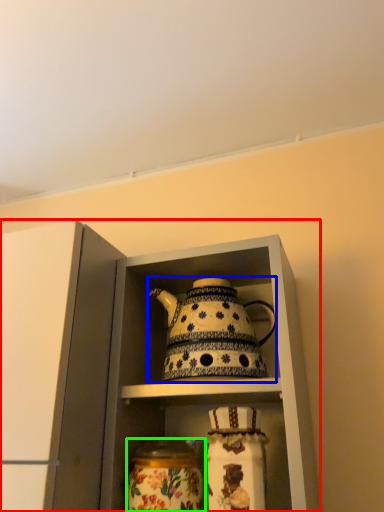
Question: Considering the real-world distances, which object is closest to cabinetry (highlighted by a red box)? kettle (highlighted by a blue box) or glass vase (highlighted by a green box).

Choices:
 (A) kettle
 (B) glass vase

Answer: (A)